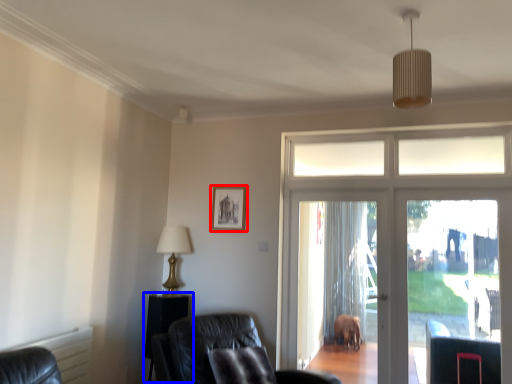
Question: Which point is closer to the camera, picture frame (highlighted by a red box) or side table (highlighted by a blue box)?

Choices:
 (A) picture frame
 (B) side table

Answer: (B)